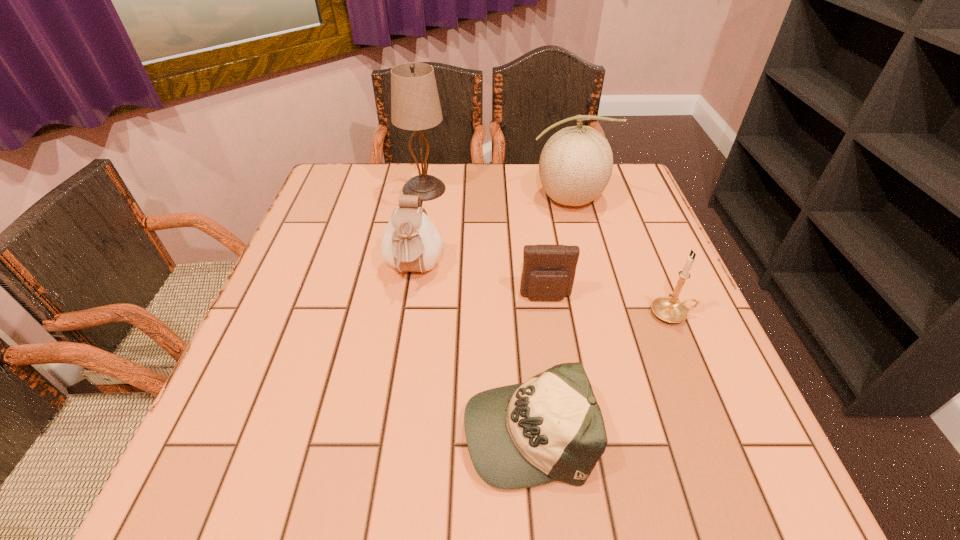
Locate an element on the screen. object that is at the far right corner is located at coordinates (576, 163).

What are the coordinates of `free space at the far edge` in the screenshot? It's located at (493, 170).

Locate an element on the screen. vacant position at the near edge of the desktop is located at coordinates (402, 477).

The height and width of the screenshot is (540, 960). In order to click on free space at the left edge of the desktop in this screenshot , I will do `click(324, 240)`.

Where is `free spot at the right edge of the desktop`? free spot at the right edge of the desktop is located at coordinates (695, 433).

Identify the location of free space at the far left corner of the desktop. (352, 174).

Identify the location of vacant space at the near left corner. (223, 470).

In the image, there is a desktop. Identify the location of free space at the near right corner. [x=749, y=501].

You are a GUI agent. You are given a task and a screenshot of the screen. Output one action in this format:
    pyautogui.click(x=<x>, y=<y>)
    Task: Click on the vacant point located between the shorter pouch and the nearest object
    The width and height of the screenshot is (960, 540).
    Given the screenshot: What is the action you would take?
    pyautogui.click(x=537, y=363)

This screenshot has height=540, width=960. Identify the location of vacant area between the second tallest object and the candle holder. (620, 256).